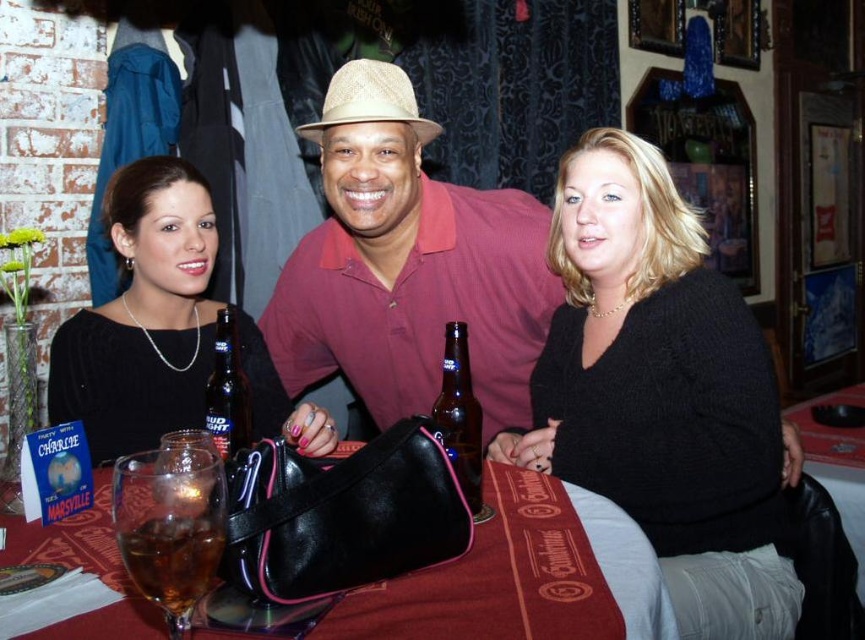
Is brown glass bottle at center wider than translucent glass bottle at center?

Incorrect, brown glass bottle at center's width does not surpass translucent glass bottle at center's.

Which is above, brown glass bottle at center or translucent glass bottle at center?

translucent glass bottle at center

Find the location of a particular element. The image size is (865, 640). brown glass bottle at center is located at coordinates tap(460, 416).

This screenshot has width=865, height=640. I want to click on brown glass bottle at center, so click(x=460, y=416).

Is point (139, 557) more distant than point (478, 509)?

No.

Is point (196, 557) positioned after point (457, 412)?

No, it is not.

In order to click on brown liquid glass at lower left in this screenshot , I will do `click(171, 556)`.

Can you confirm if matte straw hat at center is positioned to the left of smooth leather purse at center?

No, matte straw hat at center is not to the left of smooth leather purse at center.

Who is shorter, matte straw hat at center or smooth leather purse at center?

smooth leather purse at center is shorter.

Is point (299, 365) less distant than point (612, 593)?

No, it is not.

At what (x,y) coordinates should I click in order to perform the action: click on matte straw hat at center. Please return your answer as a coordinate pair (x, y). This screenshot has width=865, height=640. Looking at the image, I should click on (408, 266).